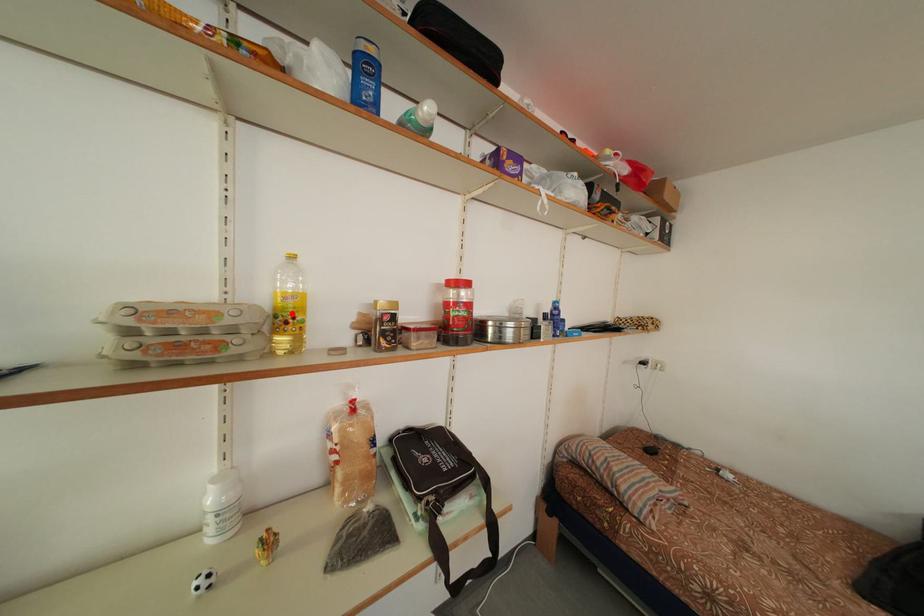
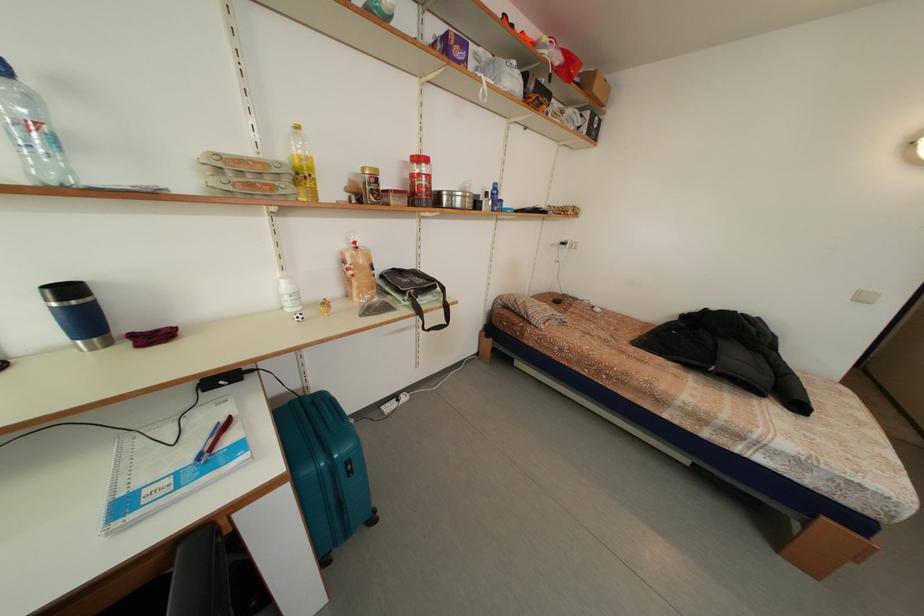
Where in the second image is the point corresponding to the highlighted location from the first image?

(310, 172)